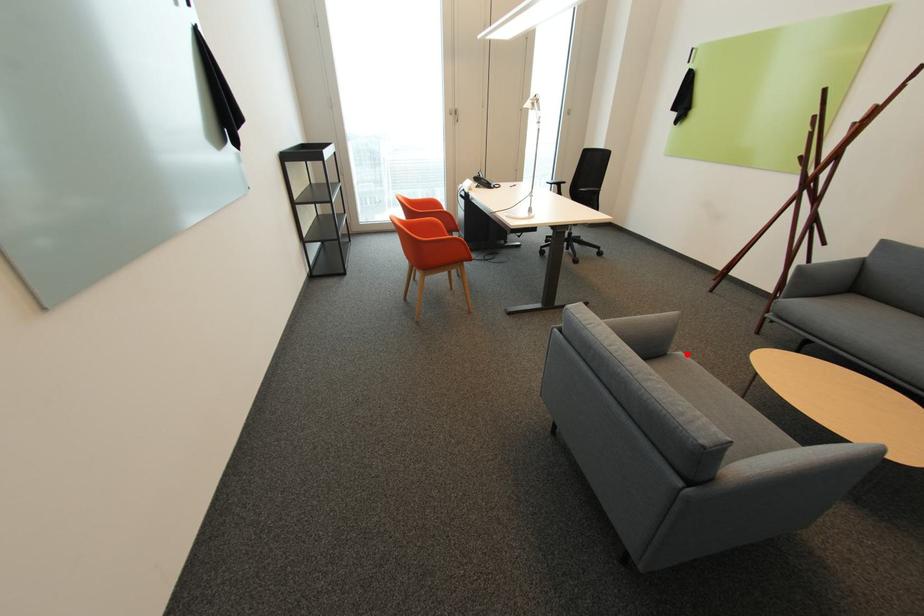
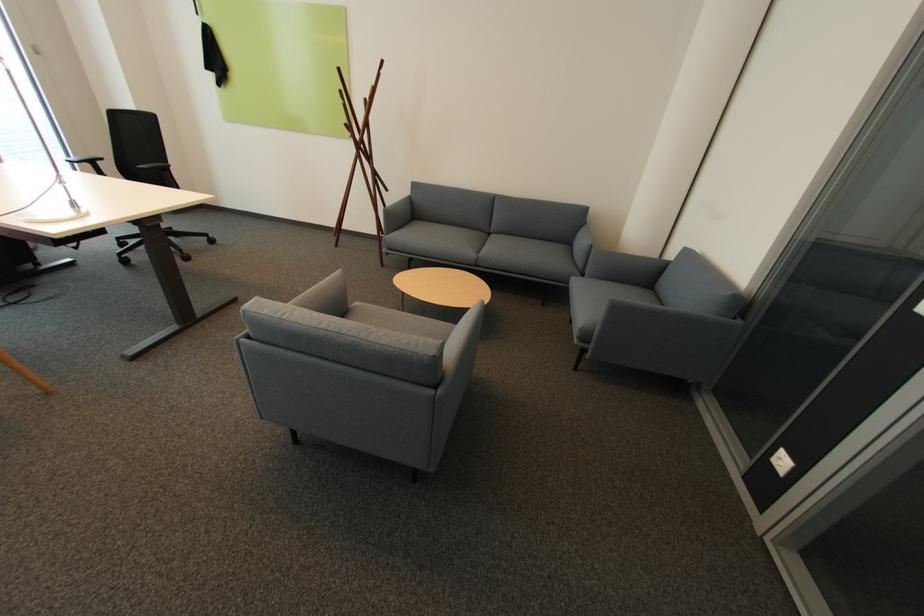
In the second image, find the point that corresponds to the highlighted location in the first image.

(362, 304)